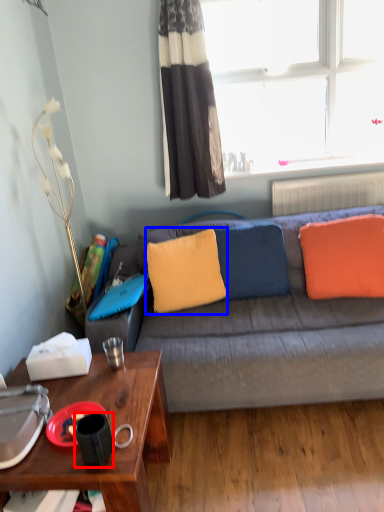
Question: Among these objects, which one is farthest to the camera, coffee cup (highlighted by a red box) or pillow (highlighted by a blue box)?

Choices:
 (A) coffee cup
 (B) pillow

Answer: (B)